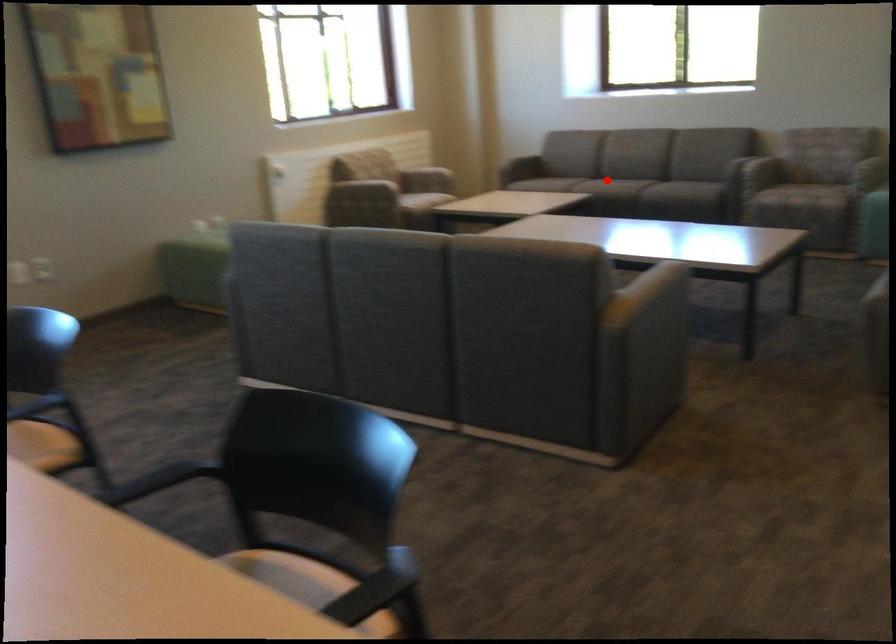
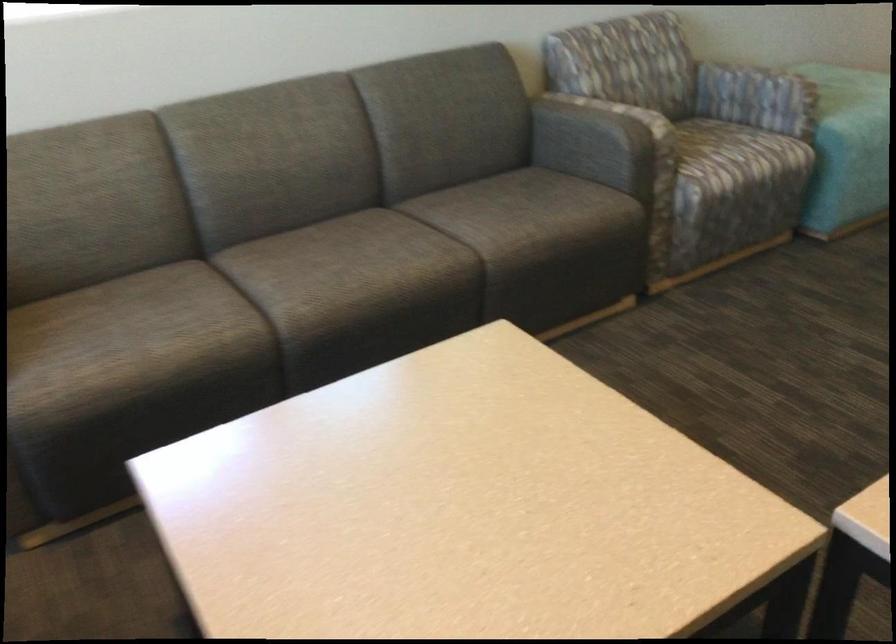
In the second image, find the point that corresponds to the highlighted location in the first image.

(427, 269)